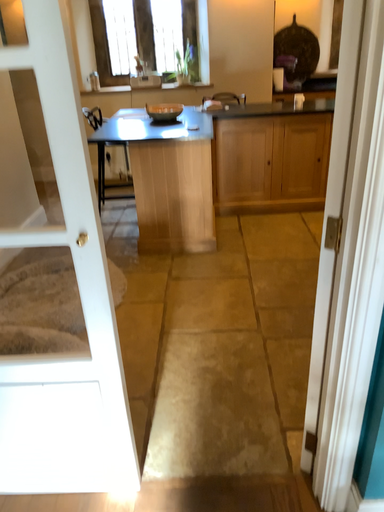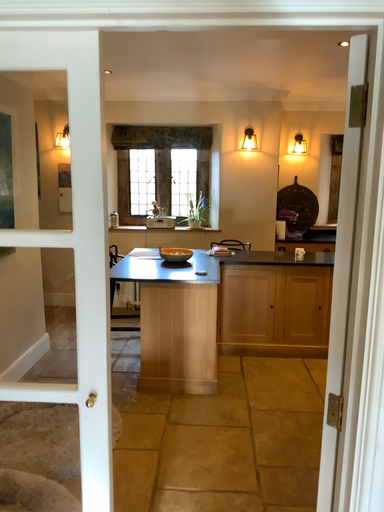
Question: How did the camera likely rotate when shooting the video?

Choices:
 (A) rotated downward
 (B) rotated upward

Answer: (B)